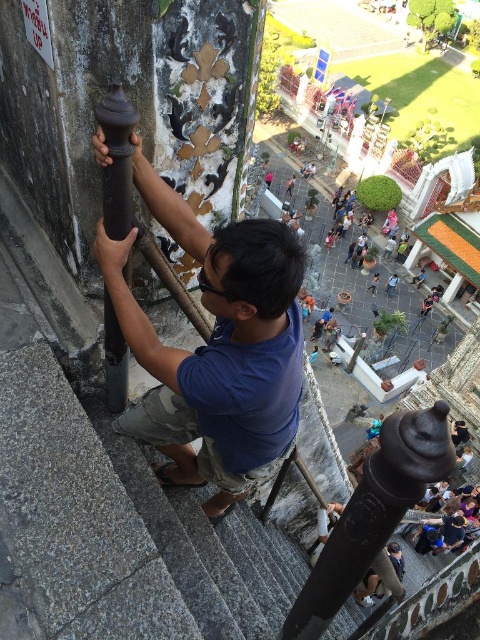
Question: Which object is positioned closest to the polished dark wood pole at center?

Choices:
 (A) dark brown polished wood at left
 (B) matte black pole at center

Answer: (B)

Question: Estimate the real-world distances between objects in this image. Which object is closer to the matte black pole at center?

Choices:
 (A) dark brown polished wood at left
 (B) polished dark wood pole at center

Answer: (B)

Question: Can you confirm if matte black pole at center is thinner than polished dark wood pole at center?

Choices:
 (A) yes
 (B) no

Answer: (A)

Question: Which object is farther from the camera taking this photo?

Choices:
 (A) polished dark wood pole at center
 (B) matte black pole at center

Answer: (B)

Question: Is polished dark wood pole at center above dark brown polished wood at left?

Choices:
 (A) yes
 (B) no

Answer: (B)

Question: Does matte black pole at center have a lesser width compared to polished dark wood pole at center?

Choices:
 (A) no
 (B) yes

Answer: (B)